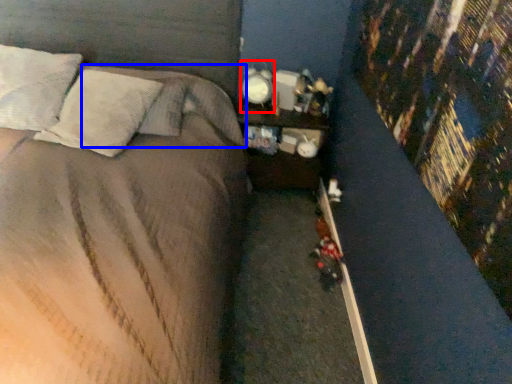
Question: Which of the following is the closest to the observer, bedside lamp (highlighted by a red box) or pillow (highlighted by a blue box)?

Choices:
 (A) bedside lamp
 (B) pillow

Answer: (B)